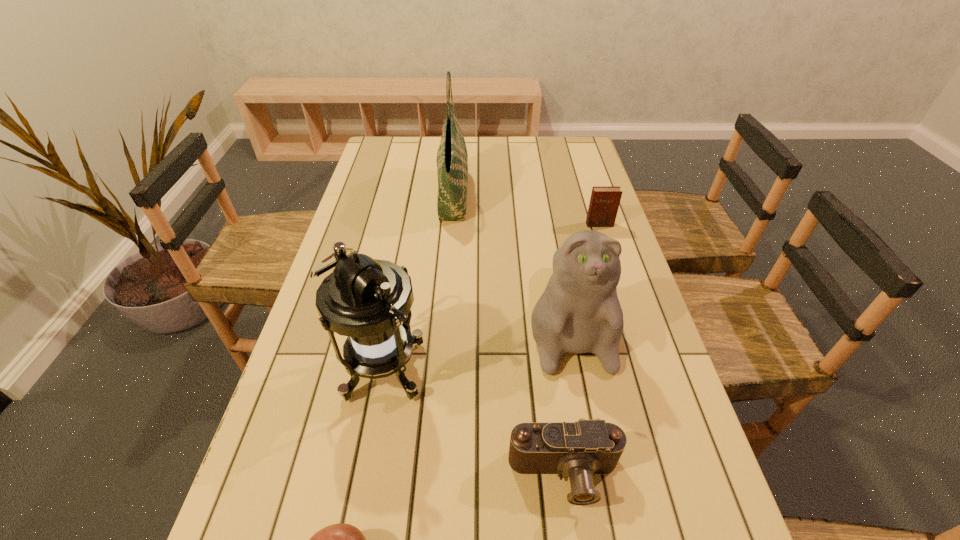
This screenshot has height=540, width=960. I want to click on vacant space situated 0.260m on the front cover of the diary, so click(x=620, y=289).

The image size is (960, 540). I want to click on object positioned at the far edge, so click(x=452, y=158).

Locate an element on the screen. This screenshot has width=960, height=540. object at the left edge is located at coordinates (365, 299).

Identify the location of cat located at the right edge. The height and width of the screenshot is (540, 960). (579, 312).

Locate an element on the screen. diary positioned at the right edge is located at coordinates (604, 202).

I want to click on camera at the right edge, so click(579, 449).

Identify the location of free space at the far edge of the desktop. This screenshot has height=540, width=960. (496, 162).

Where is `vacant space at the left edge`? vacant space at the left edge is located at coordinates (372, 241).

Locate an element on the screen. vacant space at the right edge of the desktop is located at coordinates (638, 522).

In the image, there is a desktop. At what (x,y) coordinates should I click in order to perform the action: click on vacant space at the far left corner. Please return your answer as a coordinate pair (x, y). Image resolution: width=960 pixels, height=540 pixels. Looking at the image, I should click on (407, 167).